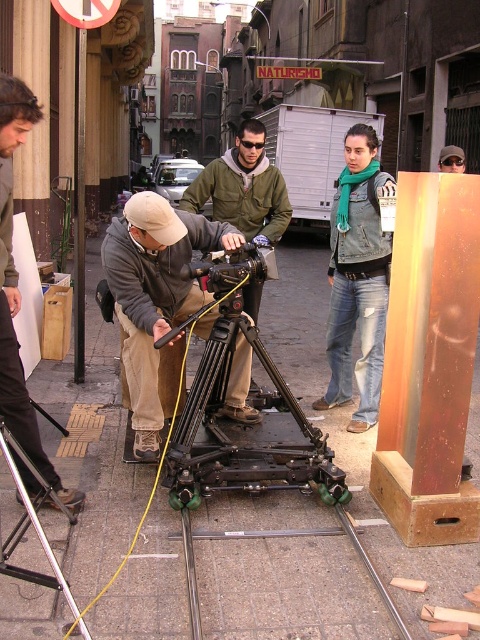
From the picture: You are an assistant director on set and need to place a prop exactly at the point marked as point (224, 406). Where should you place the prop in relation to the black matte camera on the left?

The point (224, 406) is located on the black matte camera on the left, so you should place the prop directly on the black matte camera on the left.

You are standing at the point labeled point (12,104) in the alleyway scene. If you turn around to face the opposite direction, will the point labeled point (328,353) be behind you or in front of you?

The point labeled point (328,353) is behind point (12,104), so if you turn around to face the opposite direction, the point labeled point (328,353) will be in front of you.